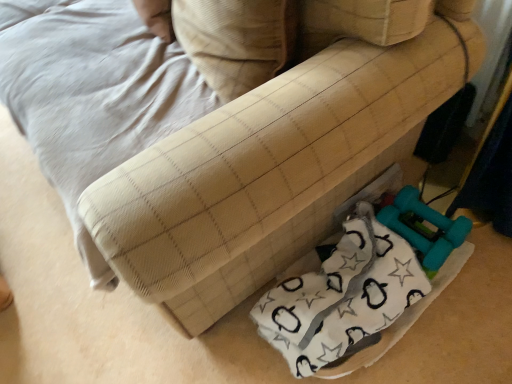
You are a GUI agent. You are given a task and a screenshot of the screen. Output one action in this format:
    pyautogui.click(x=<x>, y=<y>)
    Task: Click on the white fabric at lower right
    
    Given the screenshot: What is the action you would take?
    pyautogui.click(x=342, y=296)

What do you see at coordinates (342, 296) in the screenshot? The width and height of the screenshot is (512, 384). I see `white fabric at lower right` at bounding box center [342, 296].

Locate an element on the screen. The image size is (512, 384). beige fabric pillow at center is located at coordinates (236, 40).

What is the approximate width of beige fabric pillow at center?

21.48 centimeters.

The image size is (512, 384). Describe the element at coordinates (236, 40) in the screenshot. I see `beige fabric pillow at center` at that location.

Locate an element on the screen. The width and height of the screenshot is (512, 384). white fabric at lower right is located at coordinates (342, 296).

Considering the positions of objects beige fabric pillow at center and white fabric at lower right in the image provided, who is more to the left, beige fabric pillow at center or white fabric at lower right?

From the viewer's perspective, beige fabric pillow at center appears more on the left side.

Does beige fabric pillow at center lie in front of white fabric at lower right?

Yes.

Is point (257, 38) positioned behind point (335, 256)?

No, (257, 38) is closer to viewer.

From the image's perspective, which one is positioned lower, beige fabric pillow at center or white fabric at lower right?

From the image's view, white fabric at lower right is below.

From a real-world perspective, who is located lower, beige fabric pillow at center or white fabric at lower right?

white fabric at lower right is physically lower.

In terms of width, does beige fabric pillow at center look wider or thinner when compared to white fabric at lower right?

Clearly, beige fabric pillow at center has less width compared to white fabric at lower right.

Who is taller, beige fabric pillow at center or white fabric at lower right?

With more height is beige fabric pillow at center.

Considering the relative sizes of beige fabric pillow at center and white fabric at lower right in the image provided, is beige fabric pillow at center bigger than white fabric at lower right?

No, beige fabric pillow at center is not bigger than white fabric at lower right.

Is beige fabric pillow at center situated inside white fabric at lower right or outside?

beige fabric pillow at center is not inside white fabric at lower right, it's outside.

Would you consider beige fabric pillow at center to be distant from white fabric at lower right?

No, there isn't a large distance between beige fabric pillow at center and white fabric at lower right.

Is beige fabric pillow at center facing away from white fabric at lower right?

No, beige fabric pillow at center is not facing away from white fabric at lower right.

How different are the orientations of beige fabric pillow at center and white fabric at lower right in degrees?

They differ by 5.69 degrees in their facing directions.

How much distance is there between beige fabric pillow at center and white fabric at lower right?

beige fabric pillow at center is 21.99 inches from white fabric at lower right.

In the image, there is a white fabric at lower right. Find the location of `pillow above it (from the image's perspective)`. pillow above it (from the image's perspective) is located at coordinates (236, 40).

Considering the positions of objects white fabric at lower right and beige fabric pillow at center in the image provided, who is more to the right, white fabric at lower right or beige fabric pillow at center?

white fabric at lower right.

Looking at this image, does white fabric at lower right come in front of beige fabric pillow at center?

No, white fabric at lower right is further to the viewer.

Is point (265, 331) behind point (203, 21)?

That is True.

From the image's perspective, between white fabric at lower right and beige fabric pillow at center, which one is located above?

beige fabric pillow at center is shown above in the image.

From a real-world perspective, which object rests below the other?

white fabric at lower right, from a real-world perspective.

Between white fabric at lower right and beige fabric pillow at center, which one has larger width?

white fabric at lower right is wider.

Between white fabric at lower right and beige fabric pillow at center, which one has less height?

With less height is white fabric at lower right.

Considering the sizes of white fabric at lower right and beige fabric pillow at center in the image, is white fabric at lower right bigger or smaller than beige fabric pillow at center?

Considering their sizes, white fabric at lower right takes up more space than beige fabric pillow at center.

Is white fabric at lower right situated inside beige fabric pillow at center or outside?

white fabric at lower right cannot be found inside beige fabric pillow at center.

Is white fabric at lower right positioned far away from beige fabric pillow at center?

No.

Based on the photo, could you tell me if white fabric at lower right is facing beige fabric pillow at center?

No.

The image size is (512, 384). Identify the location of material on the right of beige fabric pillow at center. pyautogui.click(x=342, y=296).

Where is `material to the right of beige fabric pillow at center`? material to the right of beige fabric pillow at center is located at coordinates (342, 296).

This screenshot has height=384, width=512. In order to click on material below the beige fabric pillow at center (from a real-world perspective) in this screenshot , I will do point(342,296).